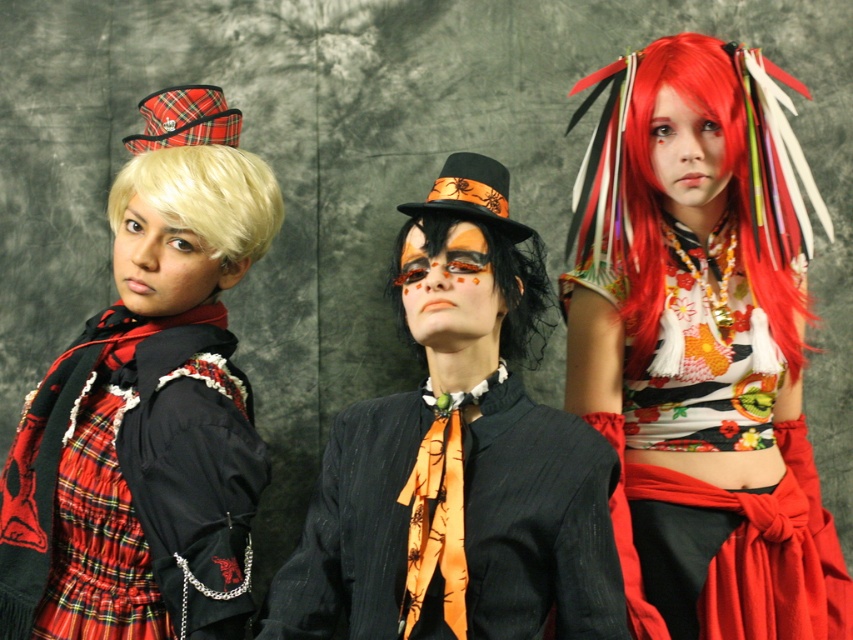
Question: Observing the image, what is the correct spatial positioning of plaid fabric jacket at left in reference to black matte wig at center?

Choices:
 (A) above
 (B) below

Answer: (B)

Question: Which of the following is the closest to the observer?

Choices:
 (A) floral fabric top at center
 (B) plaid fabric jacket at left
 (C) blonde synthetic wig at left
 (D) black matte wig at center

Answer: (D)

Question: Among these objects, which one is farthest from the camera?

Choices:
 (A) plaid fabric jacket at left
 (B) floral fabric top at center

Answer: (B)

Question: Does floral fabric top at center come in front of plaid fabric jacket at left?

Choices:
 (A) yes
 (B) no

Answer: (B)

Question: Among these points, which one is farthest from the camera?

Choices:
 (A) (624, 76)
 (B) (433, 212)

Answer: (A)

Question: Can you confirm if plaid fabric jacket at left is positioned below matte black suit at center?

Choices:
 (A) yes
 (B) no

Answer: (B)